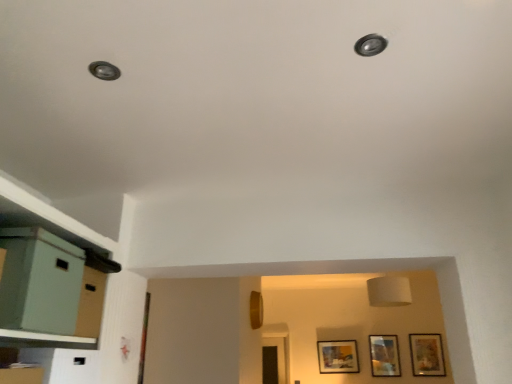
Describe the element at coordinates (40, 281) in the screenshot. The height and width of the screenshot is (384, 512). I see `matte green file cabinet at left` at that location.

Image resolution: width=512 pixels, height=384 pixels. I want to click on matte green file cabinet at left, so click(x=40, y=281).

Locate an element on the screen. wooden picture frame at lower right, the 2th picture frame in the right-to-left sequence is located at coordinates (384, 356).

Is matte gold picture frame at lower right, the first picture frame in the right-to-left sequence, bigger or smaller than matte wooden picture frame at center, which appears as the third picture frame when viewed from the right?

Clearly, matte gold picture frame at lower right, the first picture frame in the right-to-left sequence, is smaller in size than matte wooden picture frame at center, which appears as the third picture frame when viewed from the right.

Is matte gold picture frame at lower right, acting as the 3th picture frame starting from the left, located outside matte wooden picture frame at center, marked as the 1th picture frame in a left-to-right arrangement?

Yes, matte gold picture frame at lower right, acting as the 3th picture frame starting from the left, is outside of matte wooden picture frame at center, marked as the 1th picture frame in a left-to-right arrangement.

Is matte gold picture frame at lower right, acting as the 3th picture frame starting from the left, far away from matte wooden picture frame at center, which appears as the third picture frame when viewed from the right?

They are positioned close to each other.

Is matte green file cabinet at left oriented away from matte wooden picture frame at center, which appears as the third picture frame when viewed from the right?

matte green file cabinet at left is not turned away from matte wooden picture frame at center, which appears as the third picture frame when viewed from the right.

Is point (74, 293) farther from viewer compared to point (349, 367)?

No, (74, 293) is closer to viewer.

From a real-world perspective, is matte green file cabinet at left physically located above or below matte wooden picture frame at center, which appears as the third picture frame when viewed from the right?

matte green file cabinet at left is above matte wooden picture frame at center, which appears as the third picture frame when viewed from the right.

In the scene shown: Would you say matte green file cabinet at left is outside matte wooden picture frame at center, which appears as the third picture frame when viewed from the right?

Yes, matte green file cabinet at left is located beyond the bounds of matte wooden picture frame at center, which appears as the third picture frame when viewed from the right.

Identify the location of the 1st picture frame to the left of the matte gold picture frame at lower right, acting as the 3th picture frame starting from the left, starting your count from the anchor. (384, 356).

Considering the points (383, 376) and (416, 367), which point is in front, point (383, 376) or point (416, 367)?

The point (383, 376) is closer to the camera.

Is wooden picture frame at lower right, the second picture frame in the left-to-right sequence, positioned far away from matte gold picture frame at lower right, the first picture frame in the right-to-left sequence?

wooden picture frame at lower right, the second picture frame in the left-to-right sequence, is near matte gold picture frame at lower right, the first picture frame in the right-to-left sequence, not far away.

Considering the relative sizes of matte wooden picture frame at center, marked as the 1th picture frame in a left-to-right arrangement, and wooden picture frame at lower right, the 2th picture frame in the right-to-left sequence, in the image provided, is matte wooden picture frame at center, marked as the 1th picture frame in a left-to-right arrangement, shorter than wooden picture frame at lower right, the 2th picture frame in the right-to-left sequence,?

Correct, matte wooden picture frame at center, marked as the 1th picture frame in a left-to-right arrangement, is not as tall as wooden picture frame at lower right, the 2th picture frame in the right-to-left sequence.

Between point (351, 372) and point (389, 364), which one is positioned in front?

The point (389, 364) is in front.

From the image's perspective, between matte wooden picture frame at center, which appears as the third picture frame when viewed from the right, and wooden picture frame at lower right, the 2th picture frame in the right-to-left sequence, who is located below?

From the image's view, matte wooden picture frame at center, which appears as the third picture frame when viewed from the right, is below.

Is matte wooden picture frame at center, marked as the 1th picture frame in a left-to-right arrangement, outside of wooden picture frame at lower right, the 2th picture frame in the right-to-left sequence?

Indeed, matte wooden picture frame at center, marked as the 1th picture frame in a left-to-right arrangement, is completely outside wooden picture frame at lower right, the 2th picture frame in the right-to-left sequence.

In the image, is matte wooden picture frame at center, marked as the 1th picture frame in a left-to-right arrangement, positioned in front of or behind matte gold picture frame at lower right, the first picture frame in the right-to-left sequence?

Visually, matte wooden picture frame at center, marked as the 1th picture frame in a left-to-right arrangement, is located behind matte gold picture frame at lower right, the first picture frame in the right-to-left sequence.

What's the angular difference between matte wooden picture frame at center, marked as the 1th picture frame in a left-to-right arrangement, and matte gold picture frame at lower right, acting as the 3th picture frame starting from the left,'s facing directions?

matte wooden picture frame at center, marked as the 1th picture frame in a left-to-right arrangement, and matte gold picture frame at lower right, acting as the 3th picture frame starting from the left, are facing 0.00927 degrees away from each other.

Is matte wooden picture frame at center, marked as the 1th picture frame in a left-to-right arrangement, wider than matte gold picture frame at lower right, acting as the 3th picture frame starting from the left?

Correct, the width of matte wooden picture frame at center, marked as the 1th picture frame in a left-to-right arrangement, exceeds that of matte gold picture frame at lower right, acting as the 3th picture frame starting from the left.

From the image's perspective, relative to matte gold picture frame at lower right, the first picture frame in the right-to-left sequence, is matte wooden picture frame at center, which appears as the third picture frame when viewed from the right, above or below?

matte wooden picture frame at center, which appears as the third picture frame when viewed from the right, is situated lower than matte gold picture frame at lower right, the first picture frame in the right-to-left sequence, in the image.

Is matte gold picture frame at lower right, acting as the 3th picture frame starting from the left, not inside wooden picture frame at lower right, the second picture frame in the left-to-right sequence?

Yes, matte gold picture frame at lower right, acting as the 3th picture frame starting from the left, is outside of wooden picture frame at lower right, the second picture frame in the left-to-right sequence.

Is wooden picture frame at lower right, the second picture frame in the left-to-right sequence, at the back of matte gold picture frame at lower right, the first picture frame in the right-to-left sequence?

No, matte gold picture frame at lower right, the first picture frame in the right-to-left sequence, is not facing away from wooden picture frame at lower right, the second picture frame in the left-to-right sequence.

Does matte gold picture frame at lower right, acting as the 3th picture frame starting from the left, have a larger size compared to wooden picture frame at lower right, the second picture frame in the left-to-right sequence?

Yes, matte gold picture frame at lower right, acting as the 3th picture frame starting from the left, is bigger than wooden picture frame at lower right, the second picture frame in the left-to-right sequence.

Considering the sizes of objects matte gold picture frame at lower right, the first picture frame in the right-to-left sequence, and matte green file cabinet at left in the image provided, who is thinner, matte gold picture frame at lower right, the first picture frame in the right-to-left sequence, or matte green file cabinet at left?

Thinner between the two is matte gold picture frame at lower right, the first picture frame in the right-to-left sequence.

From a real-world perspective, which is physically below, matte gold picture frame at lower right, acting as the 3th picture frame starting from the left, or matte green file cabinet at left?

matte gold picture frame at lower right, acting as the 3th picture frame starting from the left, is physically lower.

Looking at the image, does matte gold picture frame at lower right, acting as the 3th picture frame starting from the left, seem bigger or smaller compared to matte green file cabinet at left?

Clearly, matte gold picture frame at lower right, acting as the 3th picture frame starting from the left, is smaller in size than matte green file cabinet at left.

Does matte gold picture frame at lower right, the first picture frame in the right-to-left sequence, lie behind matte green file cabinet at left?

Yes, matte gold picture frame at lower right, the first picture frame in the right-to-left sequence, is further from the camera.

From the matte gold picture frame at lower right, the first picture frame in the right-to-left sequence, count the 2nd picture frame to the left and point to it. Please provide its 2D coordinates.

[(338, 356)]

Locate an element on the screen. the 3rd picture frame below when counting from the matte green file cabinet at left (from the image's perspective) is located at coordinates (338, 356).

From the image, which object appears to be nearer to matte green file cabinet at left, matte gold picture frame at lower right, acting as the 3th picture frame starting from the left, or wooden picture frame at lower right, the second picture frame in the left-to-right sequence?

wooden picture frame at lower right, the second picture frame in the left-to-right sequence.

Which object lies nearer to the anchor point matte green file cabinet at left, matte wooden picture frame at center, which appears as the third picture frame when viewed from the right, or wooden picture frame at lower right, the 2th picture frame in the right-to-left sequence?

matte wooden picture frame at center, which appears as the third picture frame when viewed from the right, lies closer to matte green file cabinet at left than the other object.

Based on their spatial positions, is matte gold picture frame at lower right, the first picture frame in the right-to-left sequence, or matte wooden picture frame at center, marked as the 1th picture frame in a left-to-right arrangement, further from wooden picture frame at lower right, the second picture frame in the left-to-right sequence?

matte wooden picture frame at center, marked as the 1th picture frame in a left-to-right arrangement.

Estimate the real-world distances between objects in this image. Which object is further from wooden picture frame at lower right, the 2th picture frame in the right-to-left sequence, matte wooden picture frame at center, marked as the 1th picture frame in a left-to-right arrangement, or matte gold picture frame at lower right, the first picture frame in the right-to-left sequence?

matte wooden picture frame at center, marked as the 1th picture frame in a left-to-right arrangement, is positioned further to the anchor wooden picture frame at lower right, the 2th picture frame in the right-to-left sequence.

Which object lies further to the anchor point matte green file cabinet at left, matte gold picture frame at lower right, acting as the 3th picture frame starting from the left, or matte wooden picture frame at center, marked as the 1th picture frame in a left-to-right arrangement?

matte gold picture frame at lower right, acting as the 3th picture frame starting from the left.

When comparing their distances from matte wooden picture frame at center, which appears as the third picture frame when viewed from the right, does matte green file cabinet at left or matte gold picture frame at lower right, acting as the 3th picture frame starting from the left, seem closer?

Based on the image, matte gold picture frame at lower right, acting as the 3th picture frame starting from the left, appears to be nearer to matte wooden picture frame at center, which appears as the third picture frame when viewed from the right.

Estimate the real-world distances between objects in this image. Which object is further from matte gold picture frame at lower right, acting as the 3th picture frame starting from the left, matte green file cabinet at left or matte wooden picture frame at center, which appears as the third picture frame when viewed from the right?

A: The object further to matte gold picture frame at lower right, acting as the 3th picture frame starting from the left, is matte green file cabinet at left.

In the scene shown: Looking at the image, which one is located closer to wooden picture frame at lower right, the 2th picture frame in the right-to-left sequence, matte gold picture frame at lower right, the first picture frame in the right-to-left sequence, or matte green file cabinet at left?

Based on the image, matte gold picture frame at lower right, the first picture frame in the right-to-left sequence, appears to be nearer to wooden picture frame at lower right, the 2th picture frame in the right-to-left sequence.

The height and width of the screenshot is (384, 512). Find the location of `picture frame situated between matte wooden picture frame at center, which appears as the third picture frame when viewed from the right, and matte gold picture frame at lower right, acting as the 3th picture frame starting from the left, from left to right`. picture frame situated between matte wooden picture frame at center, which appears as the third picture frame when viewed from the right, and matte gold picture frame at lower right, acting as the 3th picture frame starting from the left, from left to right is located at coordinates (384, 356).

Where is `picture frame located between matte green file cabinet at left and wooden picture frame at lower right, the 2th picture frame in the right-to-left sequence, in the depth direction`? Image resolution: width=512 pixels, height=384 pixels. picture frame located between matte green file cabinet at left and wooden picture frame at lower right, the 2th picture frame in the right-to-left sequence, in the depth direction is located at coordinates (426, 355).